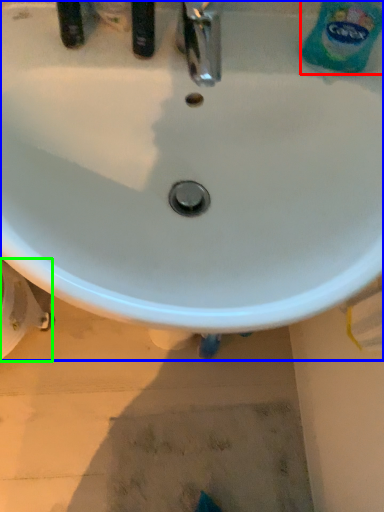
Question: Which object is positioned closest to cleaning product (highlighted by a red box)? Select from sink (highlighted by a blue box) and bidet (highlighted by a green box).

Choices:
 (A) sink
 (B) bidet

Answer: (A)